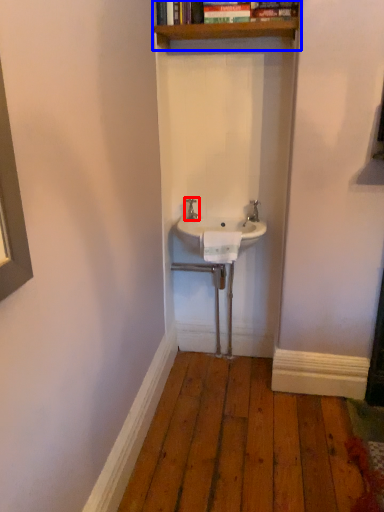
Question: Among these objects, which one is farthest to the camera, tap (highlighted by a red box) or shelf (highlighted by a blue box)?

Choices:
 (A) tap
 (B) shelf

Answer: (A)